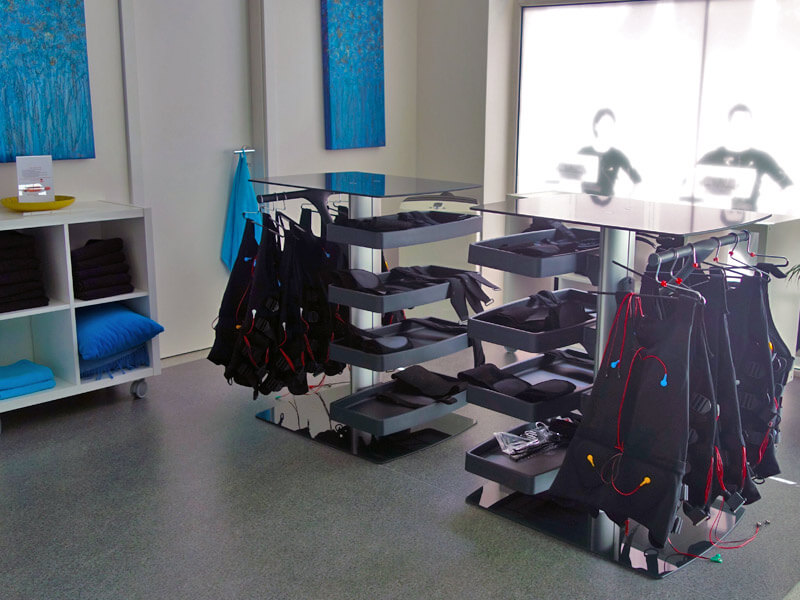
You are a GUI agent. You are given a task and a screenshot of the screen. Output one action in this format:
    pyautogui.click(x=<x>, y=<y>)
    Task: Click on the door
    The width and height of the screenshot is (800, 600).
    Given the screenshot: What is the action you would take?
    pyautogui.click(x=202, y=109)